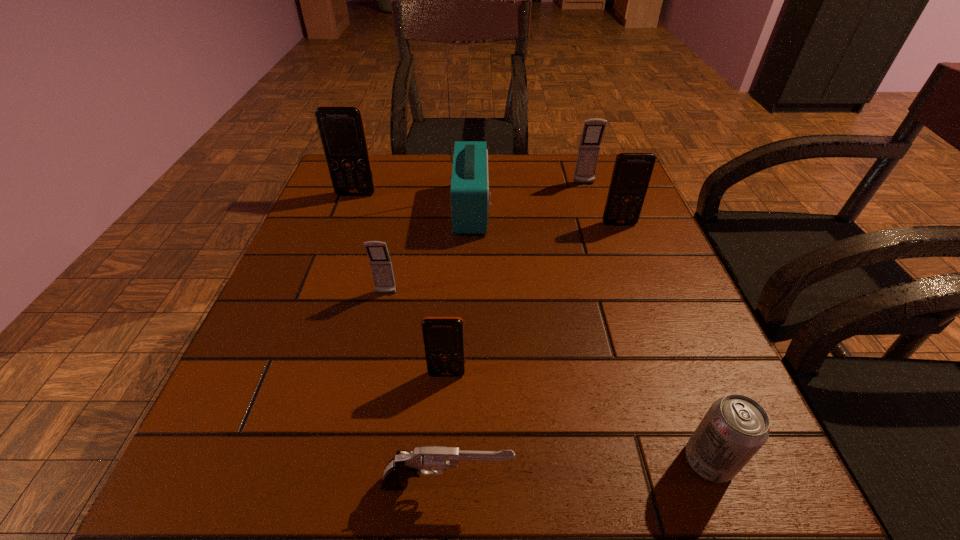
The height and width of the screenshot is (540, 960). Identify the location of vacant space at the far edge of the desktop. (492, 177).

Find the location of `free space at the near edge of the desktop`. free space at the near edge of the desktop is located at coordinates (464, 512).

The image size is (960, 540). In order to click on vacant space at the left edge in this screenshot , I will do `click(275, 289)`.

Where is `blank space at the right edge`? The height and width of the screenshot is (540, 960). blank space at the right edge is located at coordinates (641, 403).

Locate an element on the screen. vacant area at the near left corner of the desktop is located at coordinates pos(248,496).

The height and width of the screenshot is (540, 960). In the image, there is a desktop. What are the coordinates of `vacant space at the far right corner` in the screenshot? It's located at (567, 171).

Find the location of `vacant area that lies between the bigger gray cellular telephone and the gun`. vacant area that lies between the bigger gray cellular telephone and the gun is located at coordinates (516, 334).

The height and width of the screenshot is (540, 960). Find the location of `free space between the third farthest cellular telephone and the second object from left to right`. free space between the third farthest cellular telephone and the second object from left to right is located at coordinates tap(502, 259).

Where is `free spot between the left gray cellular telephone and the third nearest cellular telephone`? free spot between the left gray cellular telephone and the third nearest cellular telephone is located at coordinates (502, 259).

What are the coordinates of `empty space between the fourth farthest cellular telephone and the second nearest orange cellular telephone` in the screenshot? It's located at (502, 259).